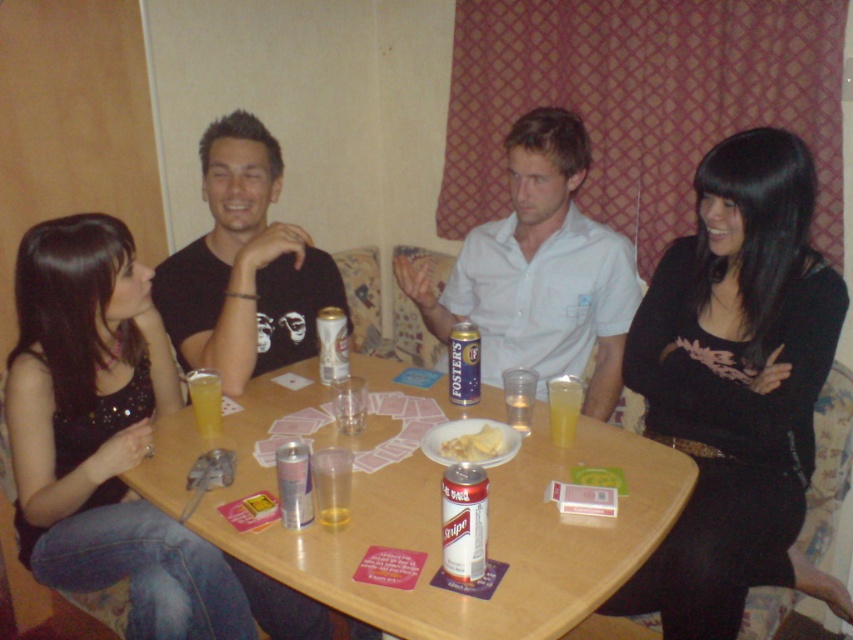
Which is above, black matte shirt at center or gold foil can at table center?

black matte shirt at center is above.

Where is `black matte shirt at center`? This screenshot has height=640, width=853. black matte shirt at center is located at coordinates (244, 266).

Is translucent plastic cup at table center shorter than translucent glass at table center?

Correct, translucent plastic cup at table center is not as tall as translucent glass at table center.

Is translucent plastic cup at table center to the left of translucent glass at table center from the viewer's perspective?

In fact, translucent plastic cup at table center is to the right of translucent glass at table center.

Is point (347, 461) closer to viewer compared to point (341, 321)?

Yes, it is in front of point (341, 321).

This screenshot has height=640, width=853. In order to click on translucent plastic cup at table center in this screenshot , I will do `click(331, 484)`.

This screenshot has width=853, height=640. Identify the location of white matte can at center. (463, 522).

Does white matte can at center appear on the left side of gold foil can at table center?

Indeed, white matte can at center is positioned on the left side of gold foil can at table center.

Which is behind, point (459, 500) or point (453, 381)?

The point (453, 381) is behind.

In order to click on white matte can at center in this screenshot , I will do `click(463, 522)`.